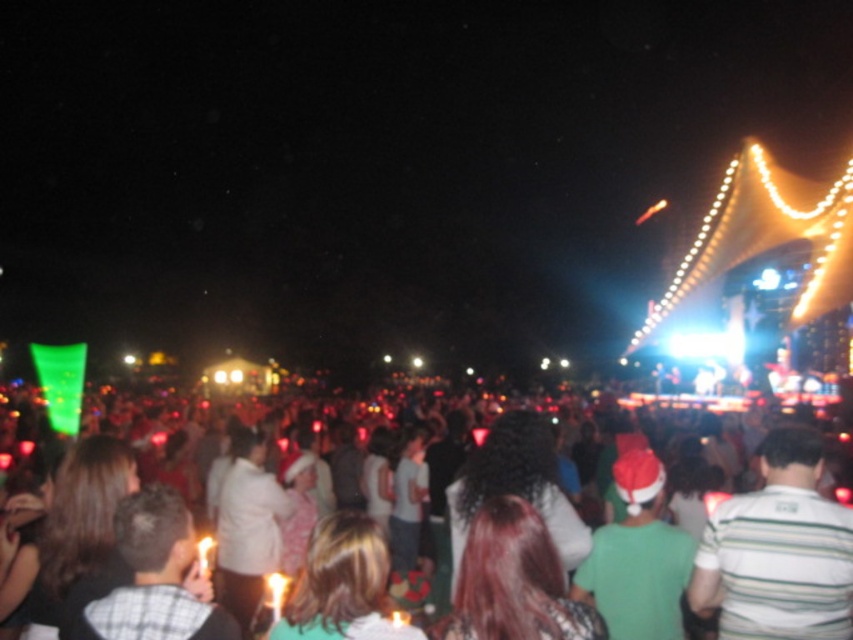
You are a photographer at the back of the crowd at this nighttime event. You want to take a photo of both the white cotton shirt at center and the striped cotton shirt at center in the same frame. The minimum distance between the shirts for your camera to focus on both is 120 feet. Can you capture both shirts in focus?

The white cotton shirt at center and striped cotton shirt at center are 123.38 feet apart from each other. Since this distance exceeds the minimum required 120 feet, your camera can focus on both shirts in the same frame.

You are at the concert and want to take a photo of both the white cotton shirt at center and the striped cotton shirt at center. Which one should you focus on first to ensure both are in the frame?

You should focus on the white cotton shirt at center first since it is closer to you than the striped cotton shirt at center, allowing both to be in the frame when properly adjusted.